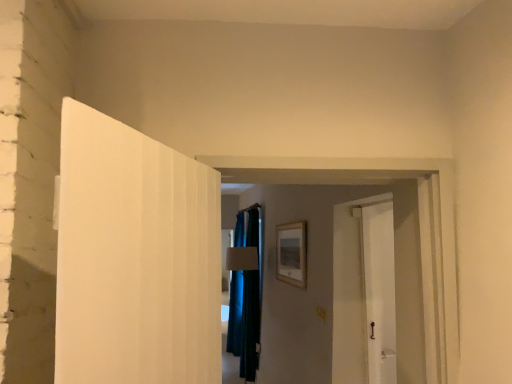
Question: Is dark blue fabric at center turned away from wooden picture frame at center?

Choices:
 (A) yes
 (B) no

Answer: (B)

Question: Does dark blue fabric at center lie in front of wooden picture frame at center?

Choices:
 (A) no
 (B) yes

Answer: (A)

Question: Does dark blue fabric at center have a smaller size compared to wooden picture frame at center?

Choices:
 (A) no
 (B) yes

Answer: (A)

Question: Is dark blue fabric at center outside of wooden picture frame at center?

Choices:
 (A) no
 (B) yes

Answer: (B)

Question: Is dark blue fabric at center facing towards wooden picture frame at center?

Choices:
 (A) no
 (B) yes

Answer: (A)

Question: Is dark blue fabric at center shorter than wooden picture frame at center?

Choices:
 (A) no
 (B) yes

Answer: (A)

Question: Is there a large distance between wooden picture frame at center and dark blue fabric at center?

Choices:
 (A) no
 (B) yes

Answer: (B)

Question: Is wooden picture frame at center surrounding dark blue fabric at center?

Choices:
 (A) no
 (B) yes

Answer: (A)

Question: Is wooden picture frame at center not within dark blue fabric at center?

Choices:
 (A) yes
 (B) no

Answer: (A)

Question: Is wooden picture frame at center positioned in front of dark blue fabric at center?

Choices:
 (A) no
 (B) yes

Answer: (B)

Question: Considering the relative sizes of wooden picture frame at center and dark blue fabric at center in the image provided, is wooden picture frame at center bigger than dark blue fabric at center?

Choices:
 (A) yes
 (B) no

Answer: (B)

Question: From the image's perspective, does wooden picture frame at center appear lower than dark blue fabric at center?

Choices:
 (A) no
 (B) yes

Answer: (A)

Question: Looking at their shapes, would you say dark blue fabric at center is wider or thinner than wooden picture frame at center?

Choices:
 (A) wide
 (B) thin

Answer: (A)